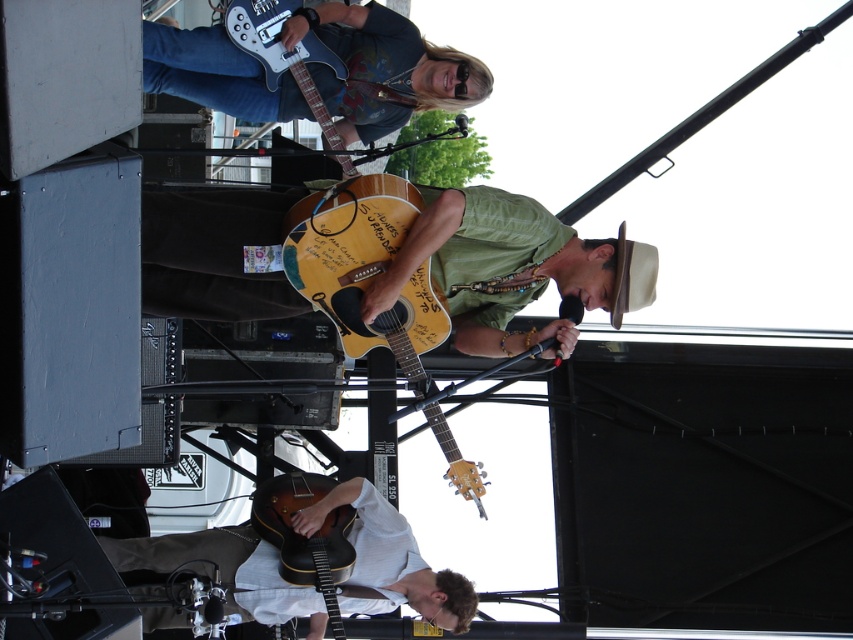
You are a photographer trying to capture the vintage brown guitar at lower center. The stage is tilted, so you need to adjust your camera angle. If the guitar is at coordinates point 0.839, 0.360, what does this mean in terms of its position on the stage?

The vintage brown guitar at lower center is positioned at point 0.839 on the horizontal axis and 0.360 on the vertical axis of the stage. This places it towards the right side and lower half of the stage, which aligns with its description as being at lower center.

You are a photographer setting up for a live music shoot. You need to place a light stand between the vintage brown guitar at lower center and the metallic silver electric guitar at upper center. Considering their widths, which guitar requires a wider base to avoid tipping over?

The vintage brown guitar at lower center requires a wider base because its width surpasses that of the metallic silver electric guitar at upper center, necessitating more stability.